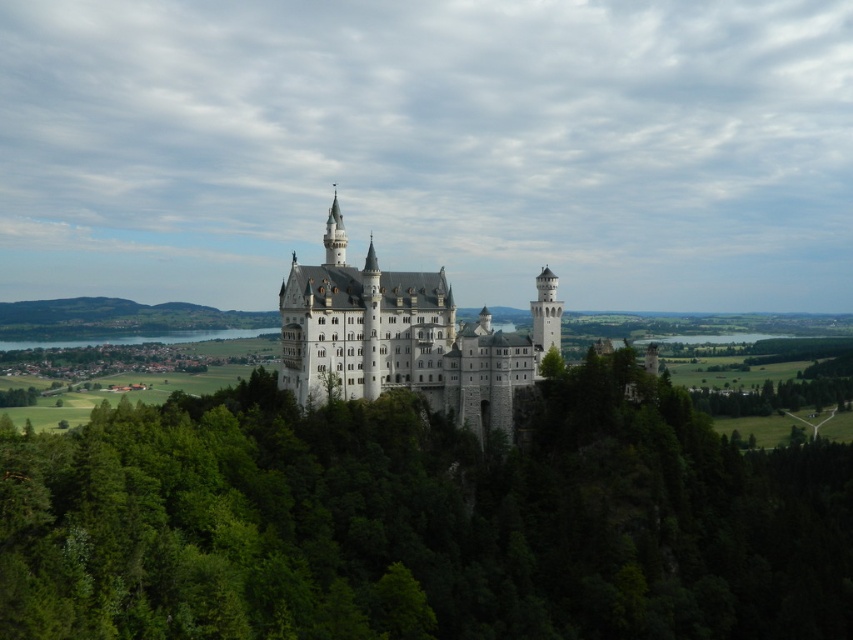
You are standing at the base of Neuschwanstein Castle and want to take a photo of the white stone castle at center with the green leafy trees at center in the background. Which direction should you face to ensure the castle is on the left side of the photo?

You should face to the right of the white stone castle at center so that the castle appears on the left side of the photo with the green leafy trees at center positioned to its right.

You are a tourist standing at the base of Neuschwanstein Castle. You notice the green leafy trees at center and the white stone castle at center. Which structure appears taller from your vantage point?

The white stone castle at center appears taller than the green leafy trees at center because the green leafy trees at center is not as tall as the white stone castle at center.

You are a tourist standing at the base of Neuschwanstein Castle. You want to take a photo that includes both the green leafy trees at center and the white stone castle at center. Given that your camera has a maximum focus range of 20 meters, will you be able to capture both objects in sharp focus?

The green leafy trees at center is 18.65 meters away from the white stone castle at center. Since the distance between them is within the camera maximum focus range of 20 meters, you can capture both objects in sharp focus.